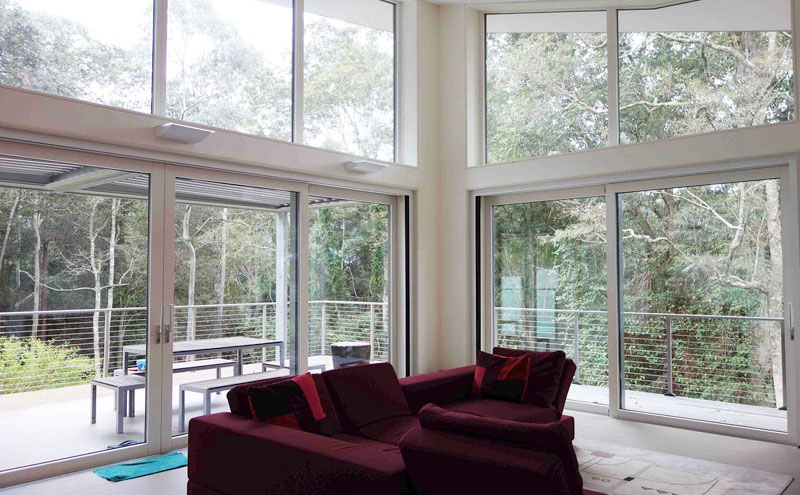
You are a GUI agent. You are given a task and a screenshot of the screen. Output one action in this format:
    pyautogui.click(x=<x>, y=<y>)
    Task: Click on the wall
    The height and width of the screenshot is (495, 800).
    Given the screenshot: What is the action you would take?
    pyautogui.click(x=433, y=103)